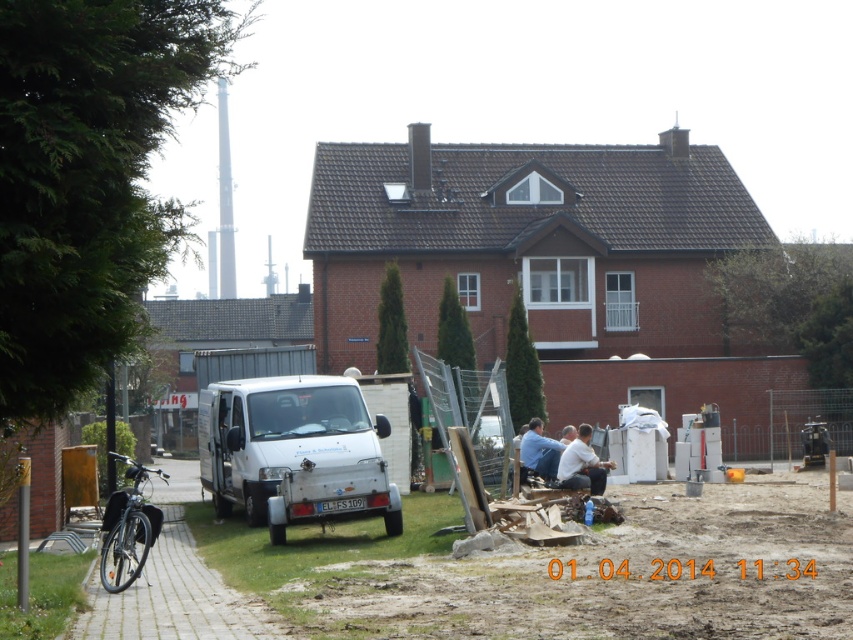
Question: Can you confirm if white matte van at center is positioned to the left of light brown leather jacket at lower center?

Choices:
 (A) no
 (B) yes

Answer: (B)

Question: Is white matte van at center below blue fabric shirt at lower center?

Choices:
 (A) no
 (B) yes

Answer: (A)

Question: Can you confirm if light brown leather jacket at lower center is positioned below blue fabric shirt at lower center?

Choices:
 (A) no
 (B) yes

Answer: (B)

Question: Which object is the closest to the light brown leather jacket at lower center?

Choices:
 (A) blue fabric shirt at lower center
 (B) white matte van at center

Answer: (A)

Question: Which point appears closest to the camera in this image?

Choices:
 (A) (227, 448)
 (B) (527, 422)

Answer: (A)

Question: Which of the following is the farthest from the observer?

Choices:
 (A) light brown leather jacket at lower center
 (B) white matte van at center

Answer: (A)